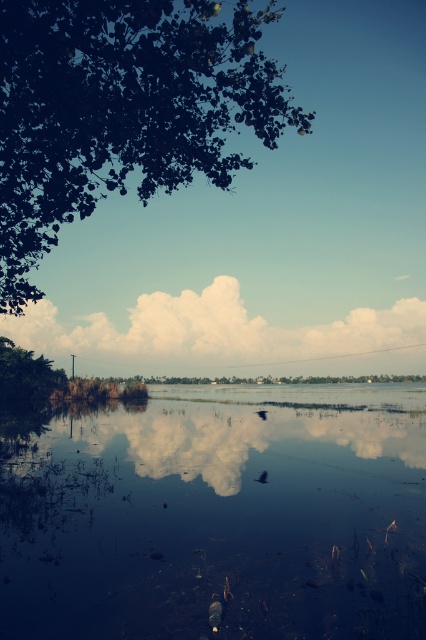
Does green leafy tree at upper left appear on the left side of white fluffy cloud at center?

Correct, you'll find green leafy tree at upper left to the left of white fluffy cloud at center.

Is green leafy tree at upper left taller than white fluffy cloud at center?

Yes.

This screenshot has height=640, width=426. Describe the element at coordinates (121, 109) in the screenshot. I see `green leafy tree at upper left` at that location.

This screenshot has width=426, height=640. I want to click on green leafy tree at upper left, so click(x=121, y=109).

Which is behind, point (322, 467) or point (11, 77)?

Point (322, 467)

Is point (104, 604) farther from viewer compared to point (85, 188)?

No, (104, 604) is in front of (85, 188).

Is point (371, 394) farther from camera compared to point (23, 300)?

Yes, point (371, 394) is behind point (23, 300).

I want to click on glossy reflective water at center, so click(x=219, y=516).

Between glossy reflective water at center and white fluffy cloud at center, which one is positioned lower?

Positioned lower is glossy reflective water at center.

Is glossy reflective water at center below white fluffy cloud at center?

Yes.

Find the location of a particular element. This screenshot has width=426, height=640. glossy reflective water at center is located at coordinates 219,516.

The width and height of the screenshot is (426, 640). Find the location of `glossy reflective water at center`. glossy reflective water at center is located at coordinates (219, 516).